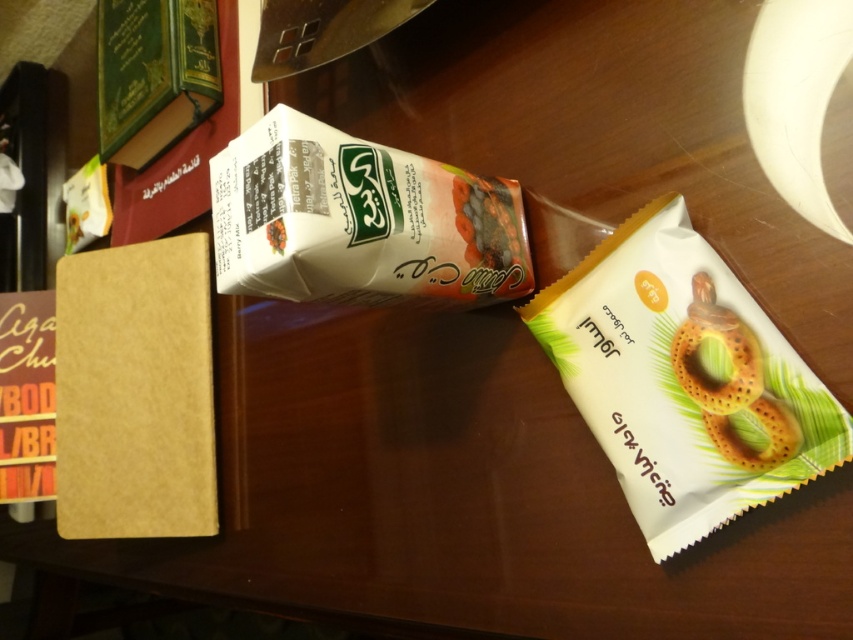
You are a food delivery person who needs to place a matte white bagel at right into a delivery box. The box can only hold items within a 50 cm diameter. Can the bagel be placed in the box?

The distance between the matte white bagel at right and the other objects is 55.90 centimeters. Since the box requires items to be within 50 cm diameter, the bagel cannot be placed in the box.

You are preparing breakfast and need to place the matte white bagel at right and the white matte juice carton at center on a shelf. The shelf has limited space. Which item requires more horizontal space?

The white matte juice carton at center requires more horizontal space because it has a greater width than the matte white bagel at right.

Consider the image. You are organizing items on a table and need to place a new item between the matte white bagel at right and the white matte juice carton at center. Where should you place it?

The matte white bagel at right is positioned on the right side of the white matte juice carton at center, so placing the new item between them would require placing it to the left of the matte white bagel at right and to the right of the white matte juice carton at center.